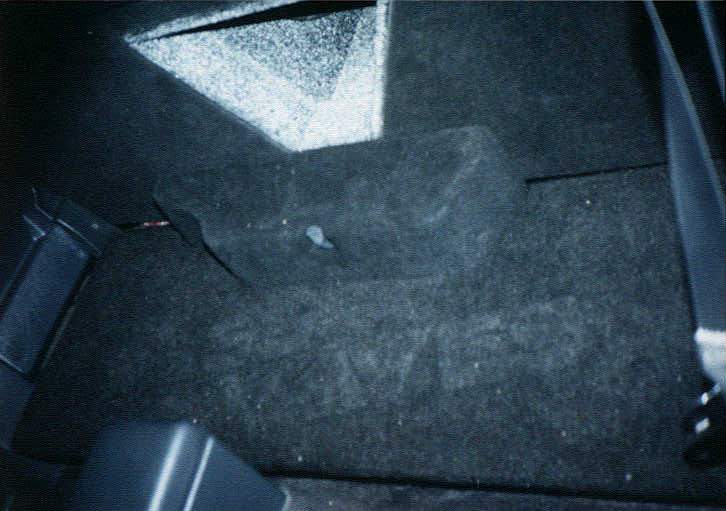
Find the location of a particular element. ceiling is located at coordinates (541, 54).